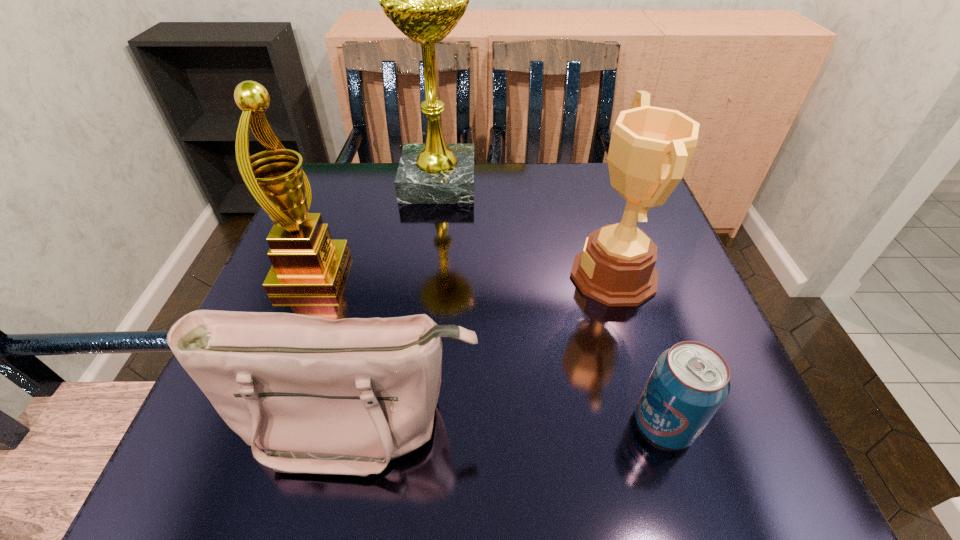
Find the location of a particular element. This screenshot has width=960, height=540. vacant area located on the front-facing side of the rightmost award is located at coordinates (394, 275).

At what (x,y) coordinates should I click in order to perform the action: click on vacant space situated on the left of the shortest object. Please return your answer as a coordinate pair (x, y). Looking at the image, I should click on (579, 424).

Locate an element on the screen. The image size is (960, 540). object that is at the far edge is located at coordinates (425, 0).

Locate an element on the screen. The height and width of the screenshot is (540, 960). shoulder bag that is at the near edge is located at coordinates (319, 396).

Identify the location of pop soda at the near edge. The width and height of the screenshot is (960, 540). 689,382.

What are the coordinates of `award located at the left edge` in the screenshot? It's located at (305, 259).

This screenshot has width=960, height=540. Find the location of `shoulder bag that is at the left edge`. shoulder bag that is at the left edge is located at coordinates (319, 396).

Locate an element on the screen. The height and width of the screenshot is (540, 960). award that is at the right edge is located at coordinates (650, 149).

Where is `pop soda that is positioned at the right edge`? This screenshot has height=540, width=960. pop soda that is positioned at the right edge is located at coordinates (689, 382).

In order to click on object that is positioned at the near left corner in this screenshot , I will do `click(319, 396)`.